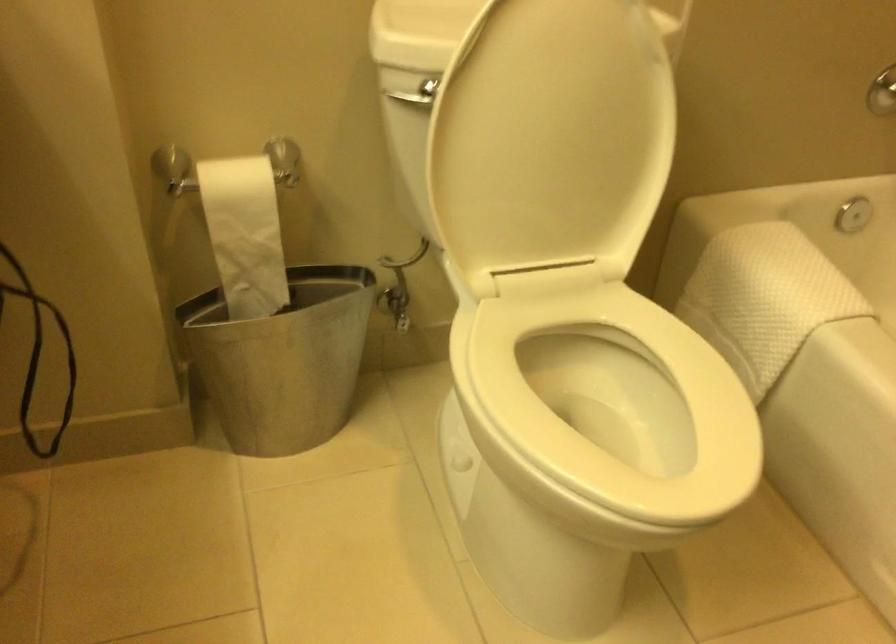
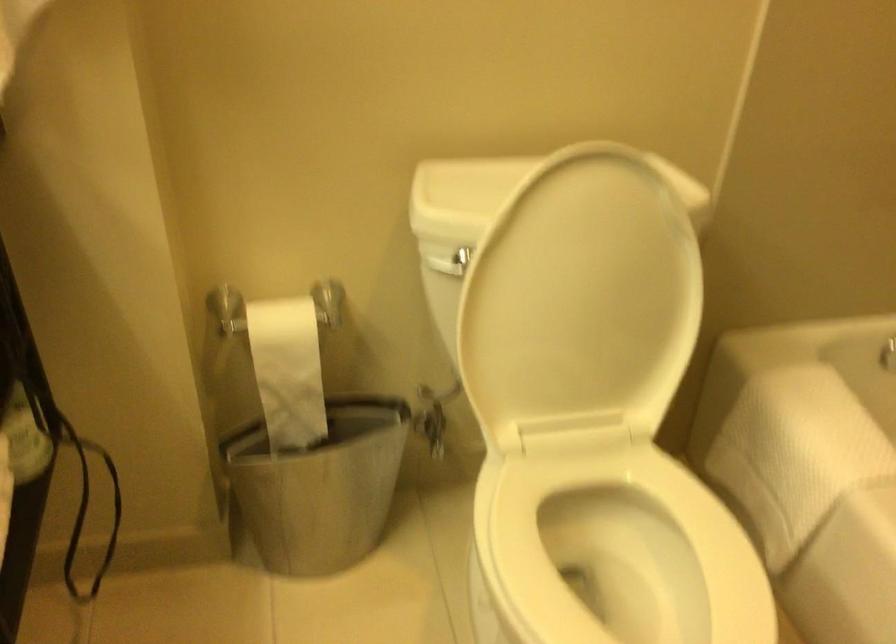
In the second image, find the point that corresponds to (x=553, y=129) in the first image.

(581, 301)